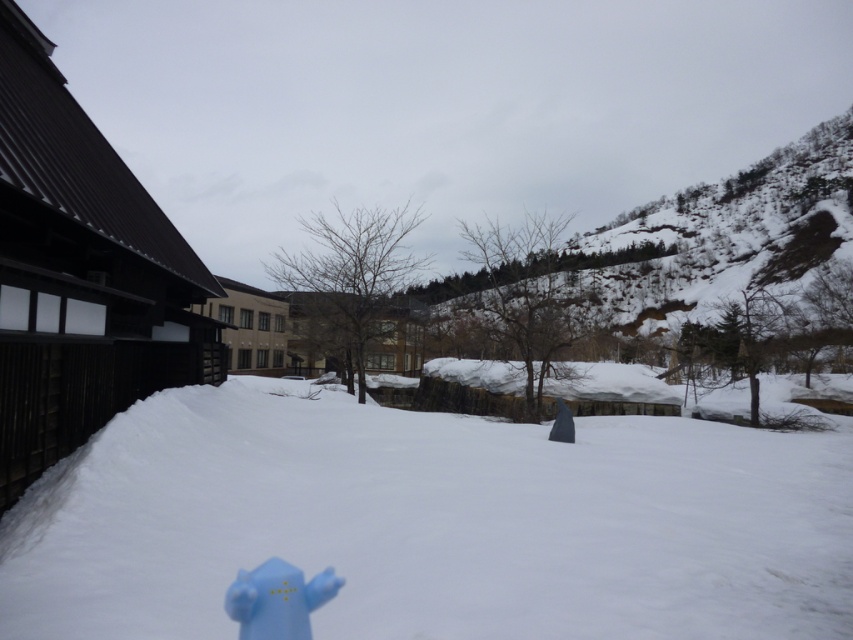
Is point (526, 483) closer to viewer compared to point (310, 598)?

No, (526, 483) is further to viewer.

Which is below, white fluffy snow at center or blue matte fire hydrant at lower left?

Positioned lower is white fluffy snow at center.

The width and height of the screenshot is (853, 640). Find the location of `white fluffy snow at center`. white fluffy snow at center is located at coordinates (432, 522).